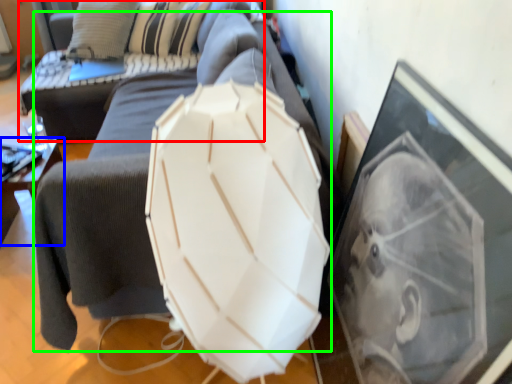
Question: Based on their relative distances, which object is farther from couch (highlighted by a red box)? Choose from furniture (highlighted by a blue box) and swivel chair (highlighted by a green box).

Choices:
 (A) furniture
 (B) swivel chair

Answer: (B)